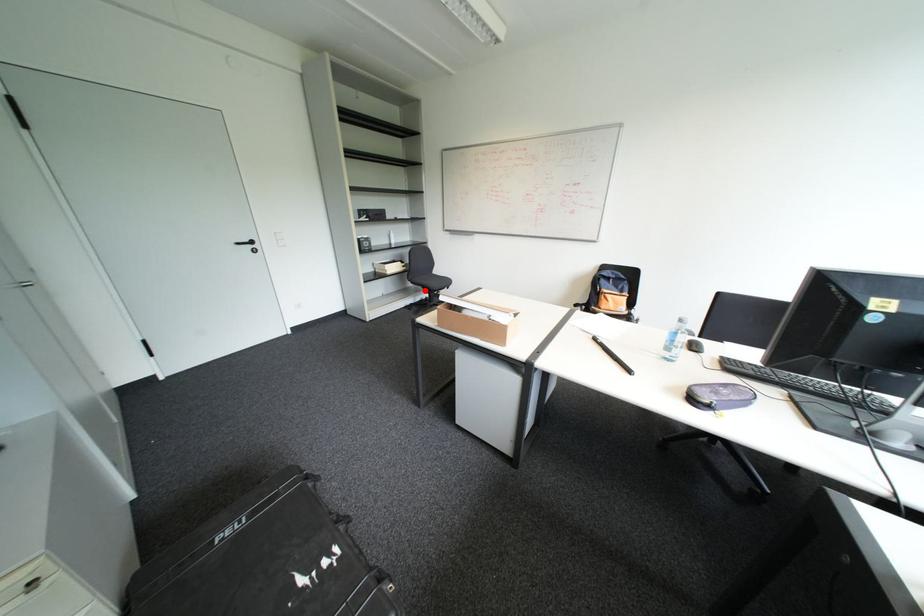
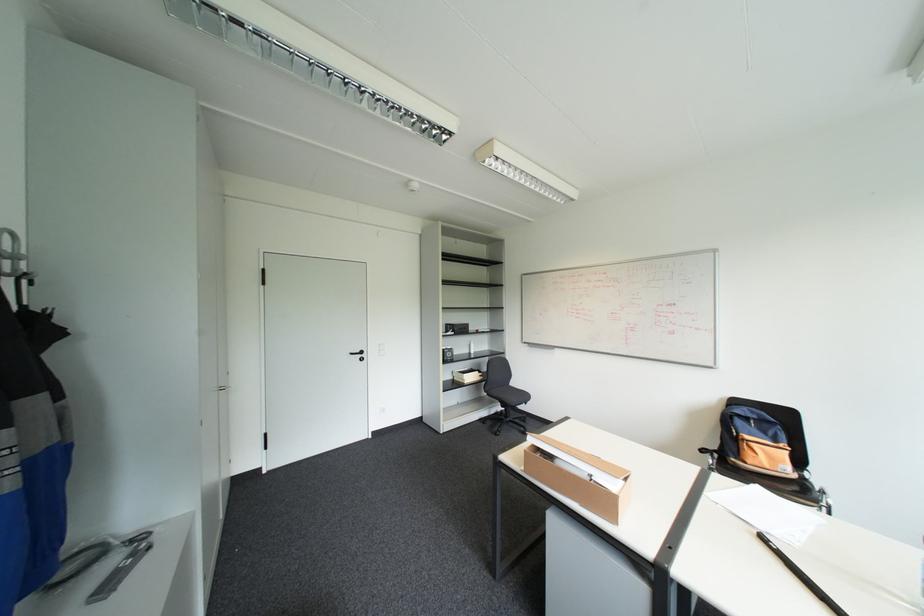
Question: A red point is marked in image1. In image2, is the corresponding 3D point closer to the camera or farther? Reply with the corresponding letter.

Choices:
 (A) The corresponding 3D point is closer.
 (B) The corresponding 3D point is farther.

Answer: (B)